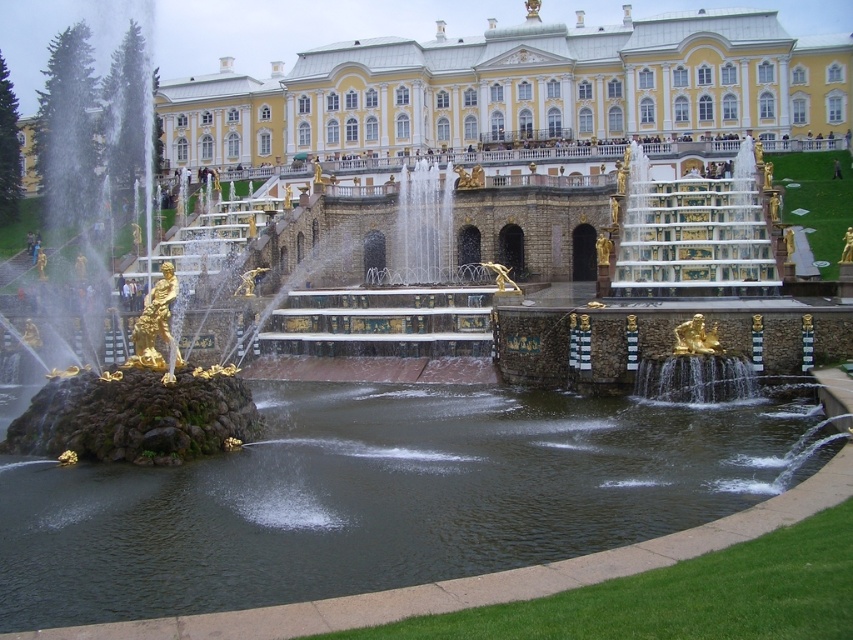
Measure the distance between point (529, 88) and camera.

141.81 meters

Can you confirm if white glossy palace at center is bigger than dark brown stone fountain at center?

Yes, white glossy palace at center is bigger than dark brown stone fountain at center.

Who is more distant from viewer, (618,52) or (717,547)?

Point (618,52)

At what (x,y) coordinates should I click in order to perform the action: click on white glossy palace at center. Please return your answer as a coordinate pair (x, y). This screenshot has height=640, width=853. Looking at the image, I should click on (518, 90).